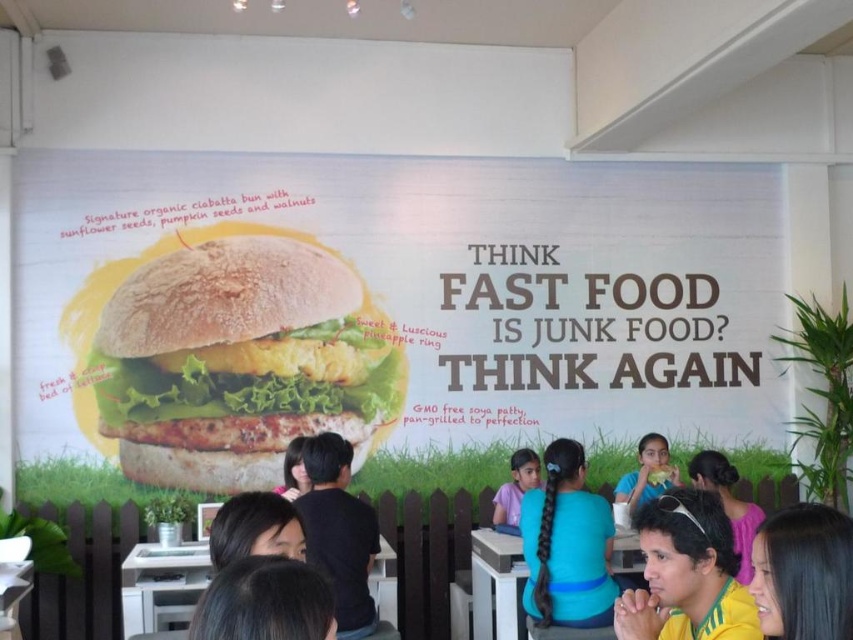
Question: Which object is the farthest from the black hair at center?

Choices:
 (A) black shirt at center
 (B) matte yellow shirt at center
 (C) golden brown bread at center

Answer: (B)

Question: Is golden brown bread at center wider than white glossy table at center?

Choices:
 (A) yes
 (B) no

Answer: (A)

Question: From the image, what is the correct spatial relationship of matte yellow shirt at center in relation to purple fabric shirt at lower center?

Choices:
 (A) above
 (B) below

Answer: (A)

Question: Is dark brown hair at upper right below purple fabric shirt at lower center?

Choices:
 (A) no
 (B) yes

Answer: (A)

Question: Which of these objects is positioned closest to the black hair at center?

Choices:
 (A) black shirt at center
 (B) golden brown bread at center
 (C) white glossy table at center
 (D) purple fabric shirt at lower center

Answer: (A)

Question: Which of the following is the closest to the observer?

Choices:
 (A) golden brown bread at center
 (B) black hair at center
 (C) matte black shirt at center
 (D) matte yellow shirt at center

Answer: (D)